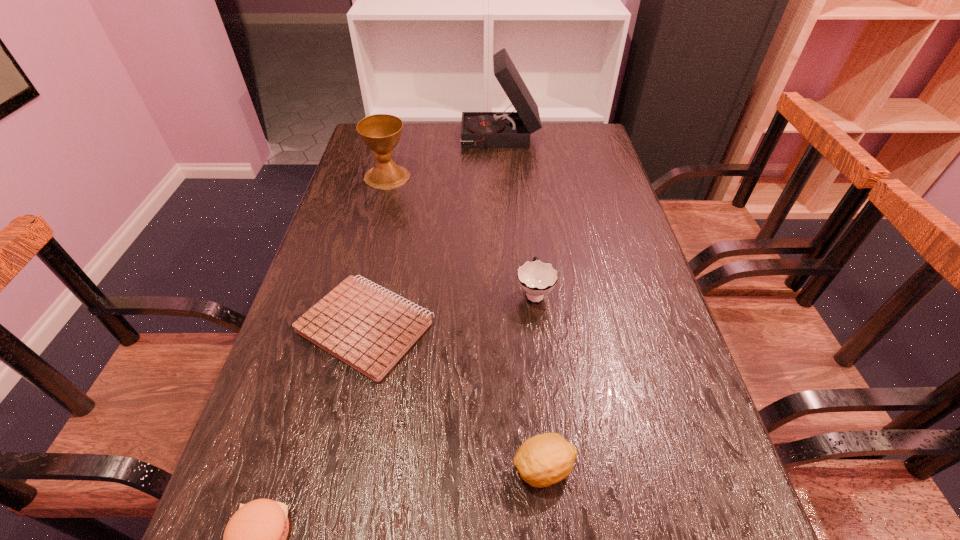
Identify the location of the farthest object. This screenshot has height=540, width=960. (504, 129).

Where is `phonograph_record`? The height and width of the screenshot is (540, 960). phonograph_record is located at coordinates (504, 129).

Where is `chalice`? This screenshot has width=960, height=540. chalice is located at coordinates [381, 133].

You are a GUI agent. You are given a task and a screenshot of the screen. Output one action in this format:
    pyautogui.click(x=<x>, y=<y>)
    Task: Click on the fifth shortest object
    Image resolution: width=960 pixels, height=540 pixels.
    Given the screenshot: What is the action you would take?
    pyautogui.click(x=381, y=133)

The image size is (960, 540). Find the location of `cup`. cup is located at coordinates (537, 278).

Identify the location of lemon. This screenshot has width=960, height=540. (545, 459).

You are a GUI agent. You are given a task and a screenshot of the screen. Output one action in this format:
    pyautogui.click(x=<x>, y=<y>)
    Task: Click on the notebook
    Image resolution: width=960 pixels, height=540 pixels.
    Given the screenshot: What is the action you would take?
    pyautogui.click(x=370, y=330)

Locate an element on the screen. The height and width of the screenshot is (540, 960). vacant space positioned on the front-facing side of the tallest object is located at coordinates (382, 139).

This screenshot has height=540, width=960. What are the coordinates of `free spot located 0.200m on the front-facing side of the tallest object` in the screenshot? It's located at (403, 139).

Where is `vacant space situated 0.340m on the front-facing side of the tallest object`? The width and height of the screenshot is (960, 540). vacant space situated 0.340m on the front-facing side of the tallest object is located at coordinates (362, 139).